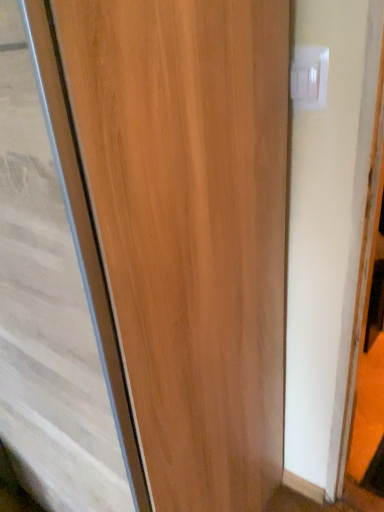
What is the approximate height of wooden door at center?

wooden door at center is 5.39 feet in height.

This screenshot has width=384, height=512. Describe the element at coordinates (191, 228) in the screenshot. I see `wooden door at center` at that location.

This screenshot has width=384, height=512. In order to click on wooden door at center in this screenshot , I will do `click(191, 228)`.

In order to face wooden door at center, should I rotate leftwards or rightwards?

Turn left by 20.494 degrees to look at wooden door at center.

This screenshot has width=384, height=512. I want to click on white plastic electric outlet at upper right, so click(309, 78).

Describe the element at coordinates (309, 78) in the screenshot. This screenshot has width=384, height=512. I see `white plastic electric outlet at upper right` at that location.

The width and height of the screenshot is (384, 512). In order to click on wooden door at center in this screenshot , I will do `click(191, 228)`.

Considering the relative positions of wooden door at center and white plastic electric outlet at upper right in the image provided, is wooden door at center to the left of white plastic electric outlet at upper right from the viewer's perspective?

Indeed, wooden door at center is positioned on the left side of white plastic electric outlet at upper right.

Is the depth of wooden door at center greater than that of white plastic electric outlet at upper right?

No.

Consider the image. Which point is more distant from viewer, [193,253] or [308,60]?

Positioned behind is point [308,60].

From the image's perspective, is wooden door at center located above white plastic electric outlet at upper right?

No.

From a real-world perspective, which object rests below the other?

In real-world perspective, wooden door at center is lower.

Is wooden door at center thinner than white plastic electric outlet at upper right?

No, wooden door at center is not thinner than white plastic electric outlet at upper right.

Considering the sizes of objects wooden door at center and white plastic electric outlet at upper right in the image provided, who is taller, wooden door at center or white plastic electric outlet at upper right?

With more height is wooden door at center.

Considering the relative sizes of wooden door at center and white plastic electric outlet at upper right in the image provided, is wooden door at center smaller than white plastic electric outlet at upper right?

Incorrect, wooden door at center is not smaller in size than white plastic electric outlet at upper right.

Is wooden door at center inside or outside of white plastic electric outlet at upper right?

wooden door at center exists outside the volume of white plastic electric outlet at upper right.

Is wooden door at center touching white plastic electric outlet at upper right?

There is a gap between wooden door at center and white plastic electric outlet at upper right.

Is wooden door at center positioned with its back to white plastic electric outlet at upper right?

No, white plastic electric outlet at upper right is not at the back of wooden door at center.

How different are the orientations of wooden door at center and white plastic electric outlet at upper right in degrees?

The angular difference between wooden door at center and white plastic electric outlet at upper right is 1.53 degrees.

This screenshot has width=384, height=512. Identify the location of door in front of the white plastic electric outlet at upper right. (191, 228).

Between white plastic electric outlet at upper right and wooden door at center, which one appears on the left side from the viewer's perspective?

Positioned to the left is wooden door at center.

Looking at this image, which object is more forward, white plastic electric outlet at upper right or wooden door at center?

wooden door at center is in front.

Does point (302, 61) appear closer or farther from the camera than point (244, 106)?

Point (302, 61) is positioned farther from the camera compared to point (244, 106).

From the image's perspective, is white plastic electric outlet at upper right above or below wooden door at center?

From the image's perspective, white plastic electric outlet at upper right appears above wooden door at center.

From a real-world perspective, is white plastic electric outlet at upper right positioned under wooden door at center based on gravity?

Incorrect, from a real-world perspective, white plastic electric outlet at upper right is higher than wooden door at center.

Which object is wider, white plastic electric outlet at upper right or wooden door at center?

With larger width is wooden door at center.

Who is taller, white plastic electric outlet at upper right or wooden door at center?

Standing taller between the two is wooden door at center.

Who is smaller, white plastic electric outlet at upper right or wooden door at center?

white plastic electric outlet at upper right is smaller.

Is wooden door at center located within white plastic electric outlet at upper right?

No, wooden door at center is not a part of white plastic electric outlet at upper right.

Is white plastic electric outlet at upper right far from wooden door at center?

They are positioned close to each other.

Is white plastic electric outlet at upper right oriented towards wooden door at center?

No, white plastic electric outlet at upper right does not turn towards wooden door at center.

Can you tell me how much white plastic electric outlet at upper right and wooden door at center differ in facing direction?

1.53 degrees.

You are a GUI agent. You are given a task and a screenshot of the screen. Output one action in this format:
    pyautogui.click(x=<x>, y=<y>)
    Task: Click on the electric outlet located behind the wooden door at center
    
    Given the screenshot: What is the action you would take?
    pyautogui.click(x=309, y=78)

Locate an element on the screen. The image size is (384, 512). door located on the left of white plastic electric outlet at upper right is located at coordinates (191, 228).

Where is `electric outlet located behind the wooden door at center`? This screenshot has width=384, height=512. electric outlet located behind the wooden door at center is located at coordinates (309, 78).